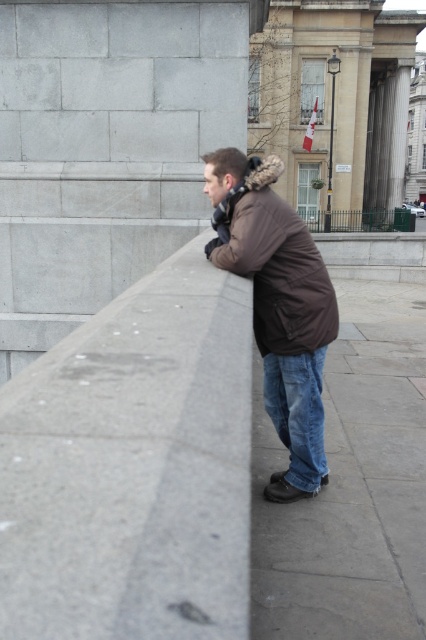
Does blue jeans at lower right have a larger size compared to brown matte jacket at center?

Correct, blue jeans at lower right is larger in size than brown matte jacket at center.

Is blue jeans at lower right above brown matte jacket at center?

Incorrect, blue jeans at lower right is not positioned above brown matte jacket at center.

Who is more distant from viewer, (339, 506) or (294, 449)?

The point (294, 449) is more distant.

Locate an element on the screen. blue jeans at lower right is located at coordinates (351, 484).

Which is above, blue jeans at lower right or blue denim jeans at lower center?

blue jeans at lower right is higher up.

Describe the element at coordinates (351, 484) in the screenshot. The width and height of the screenshot is (426, 640). I see `blue jeans at lower right` at that location.

Who is more distant from viewer, (x=362, y=388) or (x=314, y=356)?

Point (x=362, y=388)

Locate an element on the screen. blue jeans at lower right is located at coordinates [x=351, y=484].

Which is more to the left, brown matte jacket at center or blue denim jeans at lower center?

From the viewer's perspective, brown matte jacket at center appears more on the left side.

Does brown matte jacket at center have a greater height compared to blue denim jeans at lower center?

Yes.

Locate an element on the screen. brown matte jacket at center is located at coordinates pos(278,305).